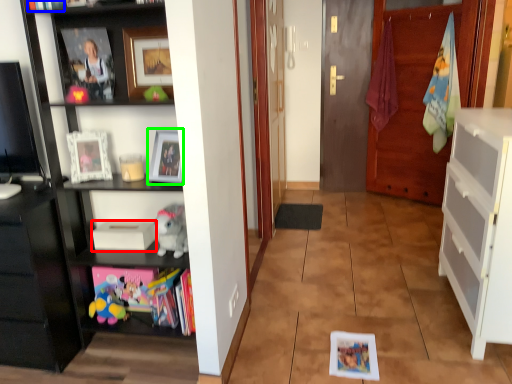
Question: Which object is the farthest from book (highlighted by a red box)? Choose among these: book (highlighted by a blue box) or picture frame (highlighted by a green box).

Choices:
 (A) book
 (B) picture frame

Answer: (A)